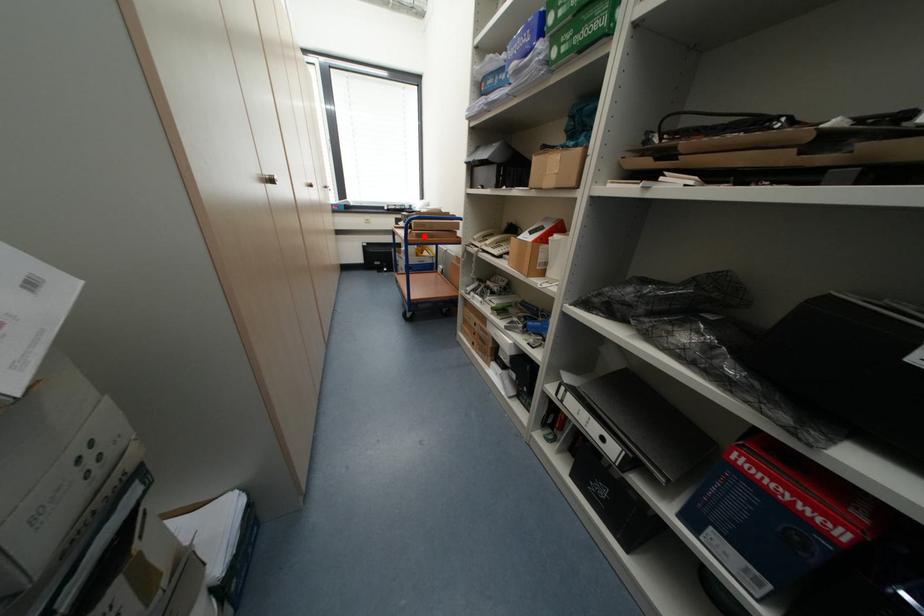
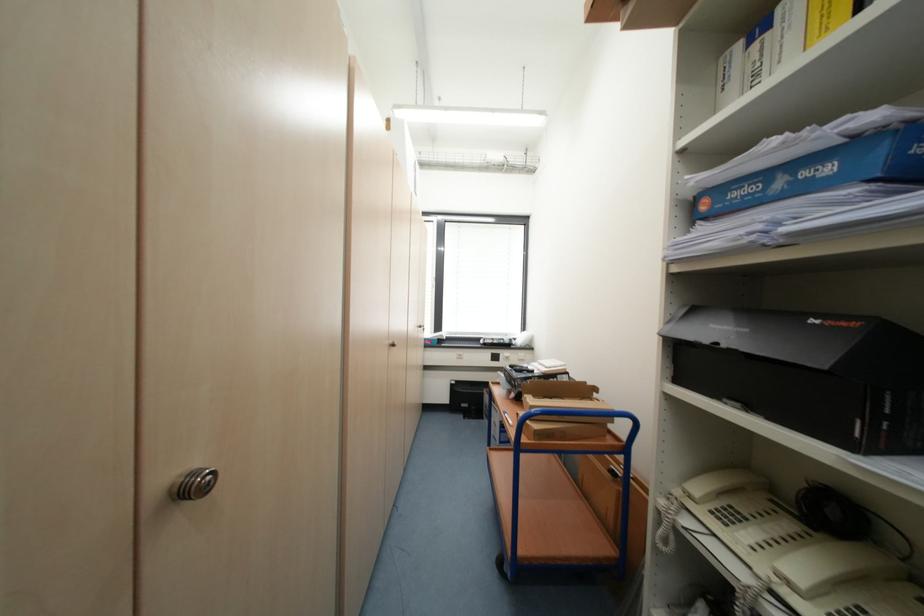
Find the pixel in the second image that matches the highlighted location in the first image.

(544, 436)